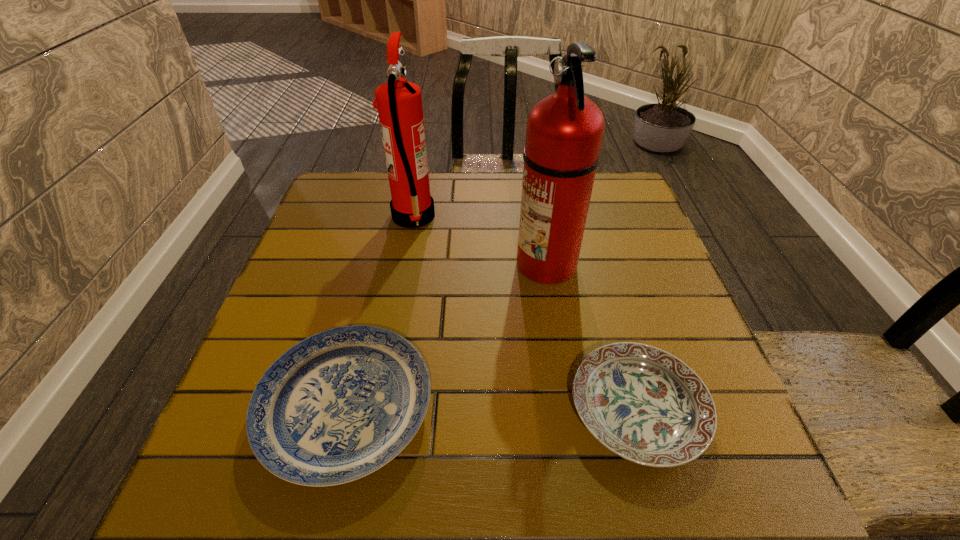
Where is `vacant position at the far right corner of the desktop`? vacant position at the far right corner of the desktop is located at coordinates (617, 176).

The width and height of the screenshot is (960, 540). Identify the location of free area in between the right fire extinguisher and the left fire extinguisher. (480, 240).

Find the location of a particular element. This screenshot has width=960, height=540. free space between the right plate and the left plate is located at coordinates (492, 409).

Image resolution: width=960 pixels, height=540 pixels. I want to click on free space between the right fire extinguisher and the right plate, so click(591, 336).

The height and width of the screenshot is (540, 960). I want to click on free space between the left plate and the right plate, so click(x=492, y=409).

Locate an element on the screen. This screenshot has height=540, width=960. free point between the left plate and the left fire extinguisher is located at coordinates (380, 312).

Image resolution: width=960 pixels, height=540 pixels. I want to click on free spot between the right plate and the right fire extinguisher, so [591, 336].

Image resolution: width=960 pixels, height=540 pixels. Find the location of `free space between the right fire extinguisher and the left plate`. free space between the right fire extinguisher and the left plate is located at coordinates 446,335.

At what (x,y) coordinates should I click in order to perform the action: click on unoccupied area between the third shortest object and the right plate. Please return your answer as a coordinate pair (x, y). The width and height of the screenshot is (960, 540). Looking at the image, I should click on (525, 314).

This screenshot has width=960, height=540. Identify the location of free space between the right fire extinguisher and the left plate. (446, 335).